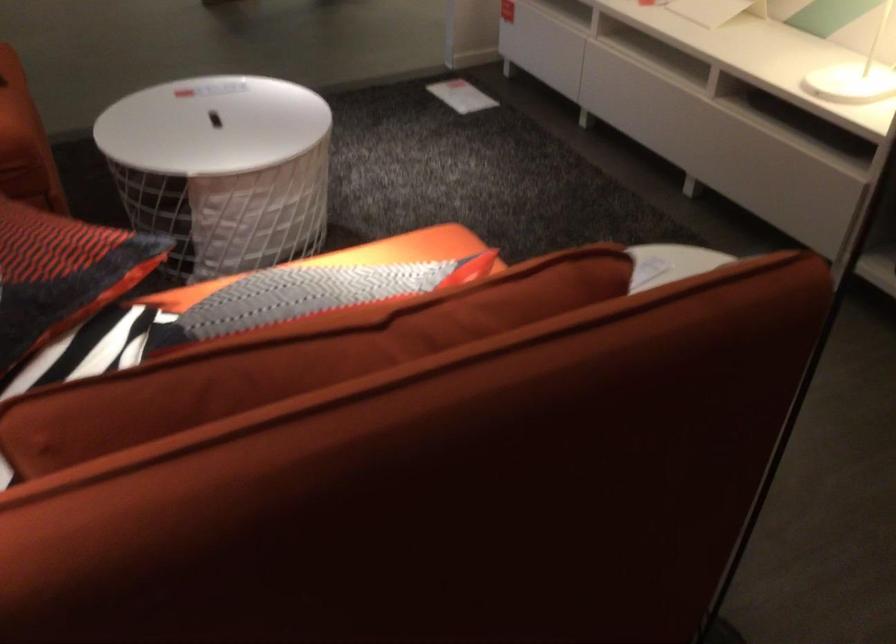
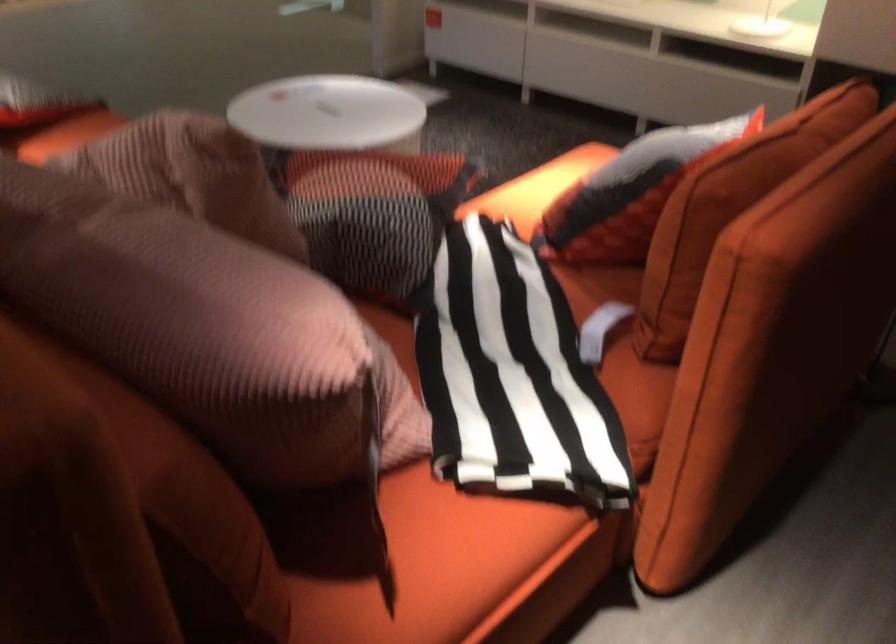
Question: Which direction would the cameraman need to move to produce the second image? Reply with the corresponding letter.

Choices:
 (A) Left
 (B) Right
 (C) Forward
 (D) Backward

Answer: (A)